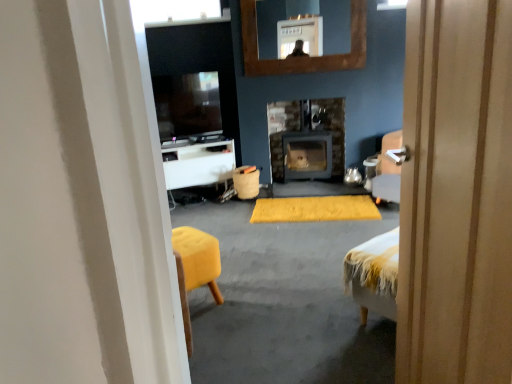
Find the location of a particular element. This screenshot has height=384, width=512. vacant region in front of burlap-like fabric trash can at center is located at coordinates (239, 210).